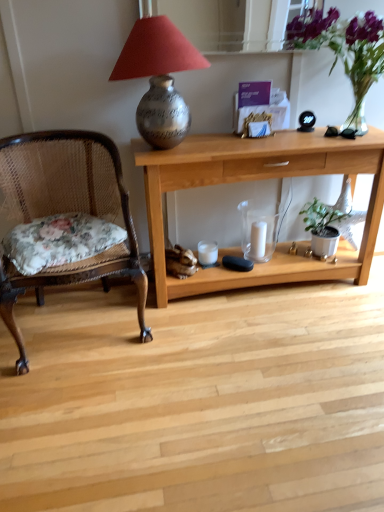
Locate an element on the screen. This screenshot has width=384, height=512. empty space that is ontop of light wood desk at center is located at coordinates (258, 140).